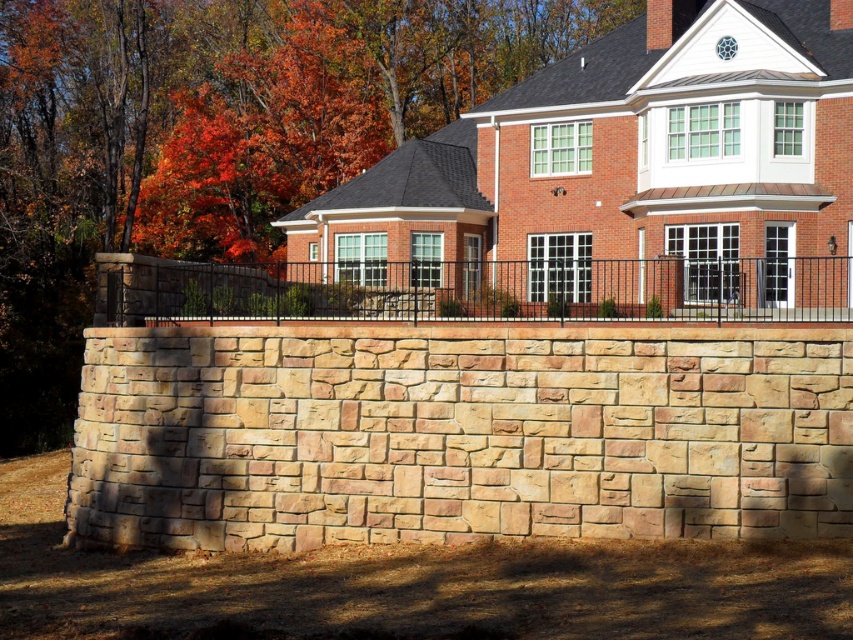
Find the location of a particular element. orange leafy tree at upper center is located at coordinates (212, 136).

Is orange leafy tree at upper center closer to camera compared to black metal fence at center?

No, orange leafy tree at upper center is behind black metal fence at center.

Identify the location of orange leafy tree at upper center. This screenshot has height=640, width=853. (212, 136).